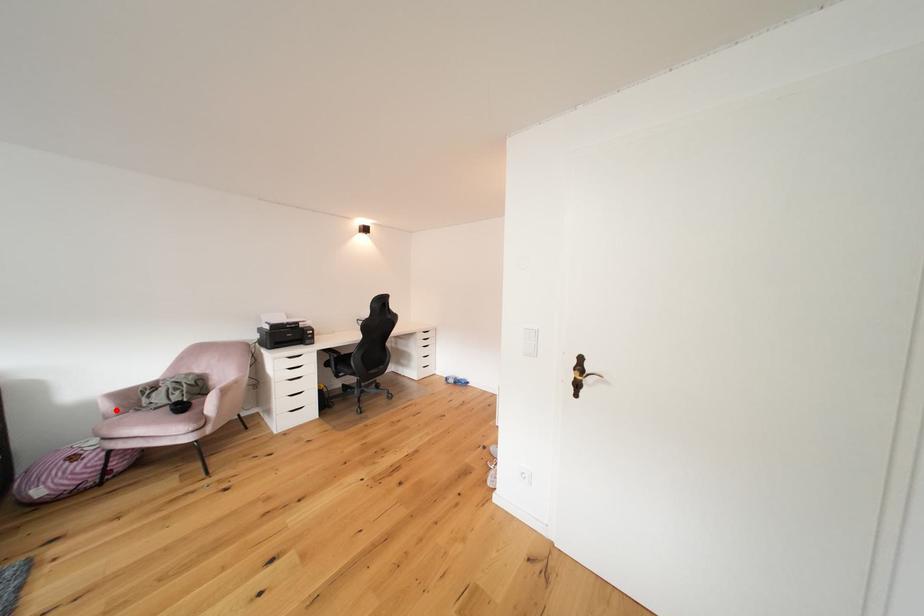
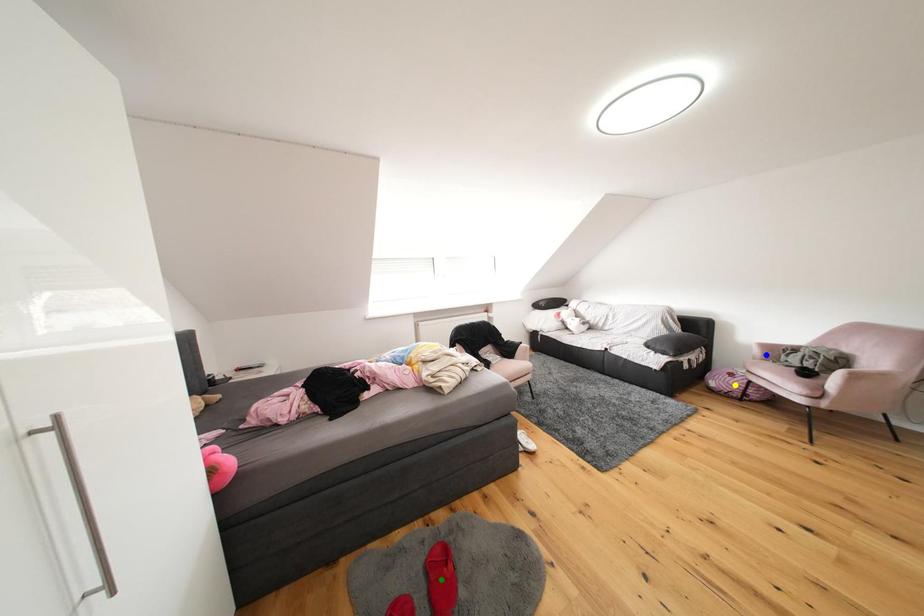
Question: I am providing you with two images of the same scene from different viewpoints. A red point is marked on the first image. You are given multiple points on the second image. Which mark in image 2 goes with the point in image 1?

Choices:
 (A) green point
 (B) blue point
 (C) yellow point

Answer: (B)